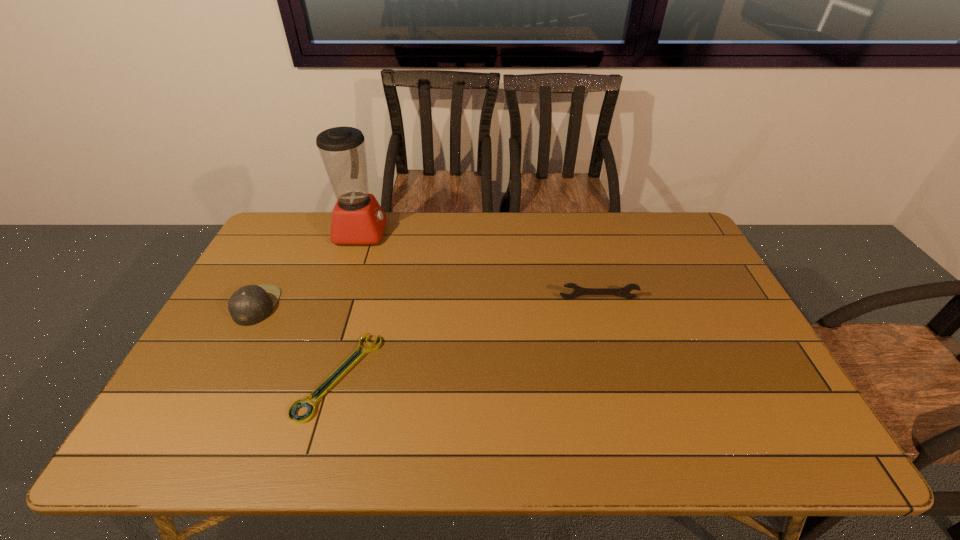
What are the coordinates of `free location located on the open ends of the rightmost object` in the screenshot? It's located at (633, 418).

Image resolution: width=960 pixels, height=540 pixels. I want to click on free space located on the back of the left wrench, so click(362, 295).

Where is `object situated at the far edge`? object situated at the far edge is located at coordinates (358, 219).

The width and height of the screenshot is (960, 540). I want to click on object that is positioned at the near edge, so click(x=357, y=355).

Image resolution: width=960 pixels, height=540 pixels. What are the coordinates of `object at the left edge` in the screenshot? It's located at (251, 304).

I want to click on vacant point at the far edge, so click(579, 217).

You are a GUI agent. You are given a task and a screenshot of the screen. Output one action in this format:
    pyautogui.click(x=<x>, y=<y>)
    Task: Click on the vacant region at the near edge of the desktop
    
    Given the screenshot: What is the action you would take?
    pyautogui.click(x=380, y=424)

Locate an element on the screen. free space at the left edge of the desktop is located at coordinates (192, 399).

Locate an element on the screen. free region at the right edge of the desktop is located at coordinates (739, 318).

In the image, there is a desktop. Where is `vacant space at the far left corner`? This screenshot has width=960, height=540. vacant space at the far left corner is located at coordinates (281, 250).